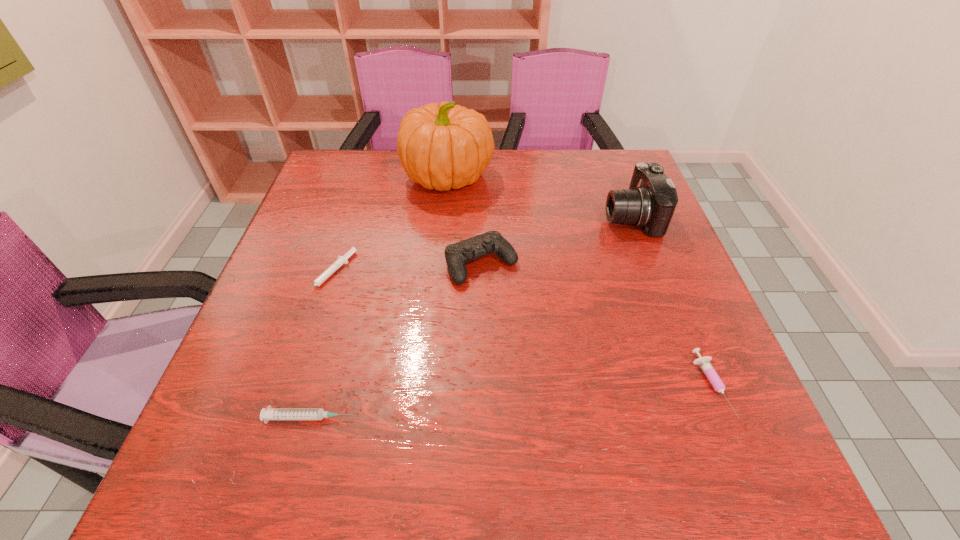
Image resolution: width=960 pixels, height=540 pixels. In order to click on vacant space at the left edge of the desktop in this screenshot , I will do `click(345, 272)`.

Locate an element on the screen. free space at the right edge of the desktop is located at coordinates (757, 423).

Find the location of `vacant space at the far left corner of the desktop`. vacant space at the far left corner of the desktop is located at coordinates (349, 157).

Locate an element on the screen. Image resolution: width=960 pixels, height=540 pixels. free space at the near right corner of the desktop is located at coordinates (761, 473).

The image size is (960, 540). In order to click on vacant region between the fourth shortest object and the shortest syringe in this screenshot , I will do `click(406, 269)`.

Locate an element on the screen. free area in between the fifth shortest object and the third tallest object is located at coordinates (556, 240).

Where is `free space between the farthest syringe and the rightmost syringe`? free space between the farthest syringe and the rightmost syringe is located at coordinates (520, 330).

At what (x,y) coordinates should I click in order to perform the action: click on free space between the shortest object and the rightmost syringe. Please return your answer as a coordinate pair (x, y). This screenshot has width=960, height=540. Looking at the image, I should click on (520, 330).

Locate an element on the screen. The width and height of the screenshot is (960, 540). unoccupied area between the control and the shortest object is located at coordinates (406, 269).

The height and width of the screenshot is (540, 960). Find the location of `free spot between the control and the shortest object`. free spot between the control and the shortest object is located at coordinates (406, 269).